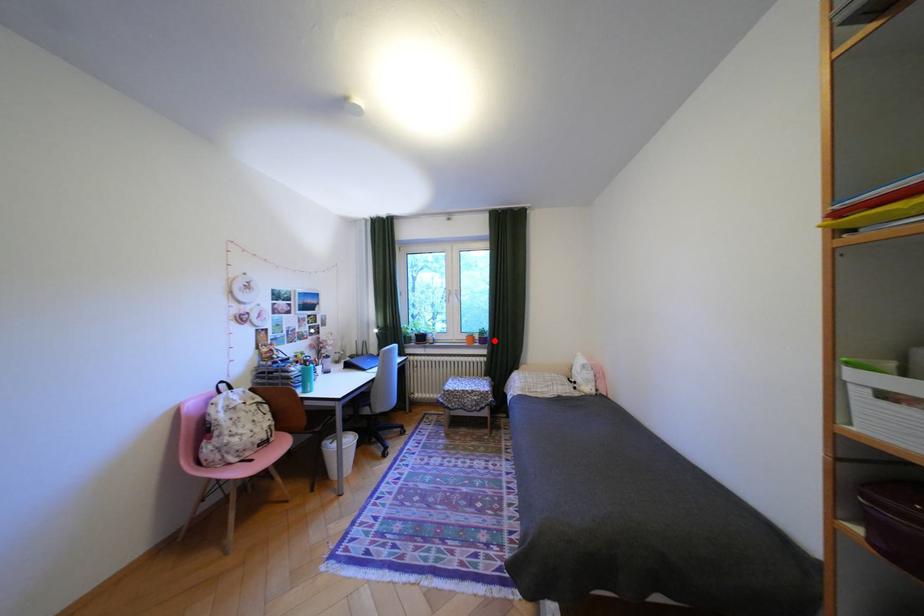
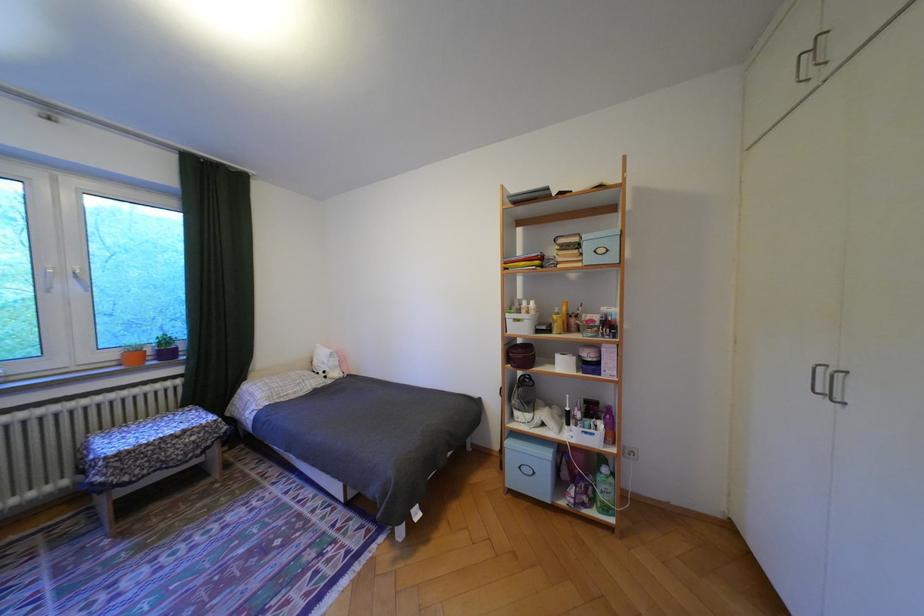
Locate, in the second image, the point that corresponds to the highlighted location in the first image.

(178, 354)